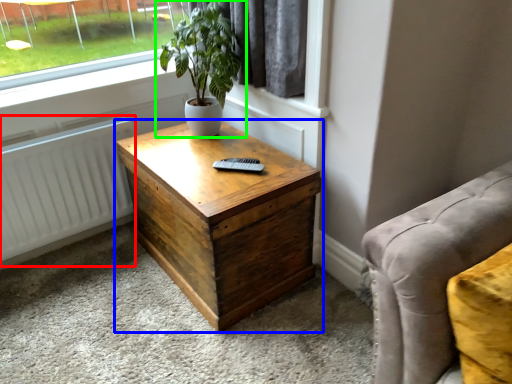
Question: Which is farther away from radiator (highlighted by a red box)? nightstand (highlighted by a blue box) or houseplant (highlighted by a green box)?

Choices:
 (A) nightstand
 (B) houseplant

Answer: (B)